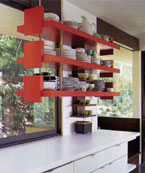
Identify the location of board at end of shelf. (110, 52), (109, 98), (108, 74), (33, 87), (32, 52), (32, 20).